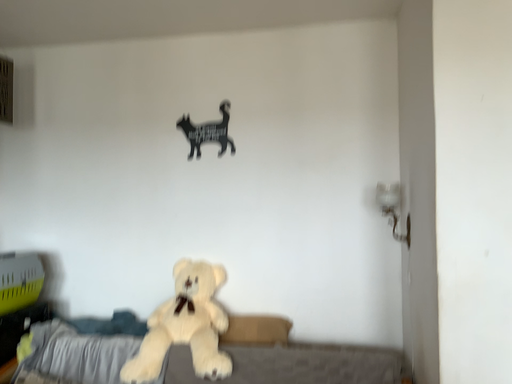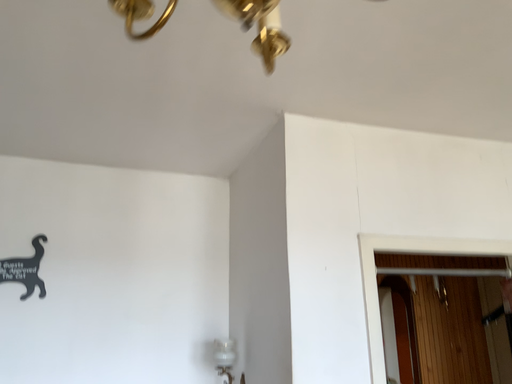
Question: Which way did the camera rotate in the video?

Choices:
 (A) rotated upward
 (B) rotated downward

Answer: (A)